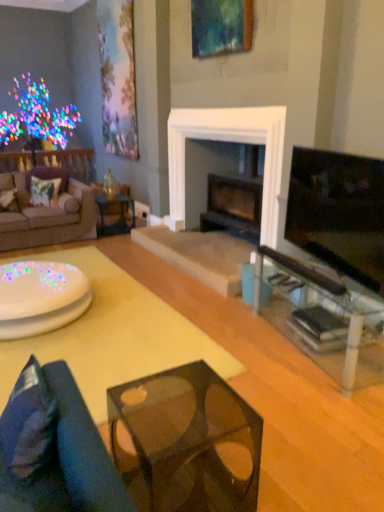
Question: Does brown fabric couch at left, positioned as the 1th studio couch in top-to-bottom order, have a lesser height compared to dark blue fabric pillow at lower left, positioned as the first pillow in front-to-back order?

Choices:
 (A) no
 (B) yes

Answer: (A)

Question: Is brown fabric couch at left, the second studio couch in the front-to-back sequence, turned away from dark blue fabric pillow at lower left, the 3th pillow from the back?

Choices:
 (A) yes
 (B) no

Answer: (B)

Question: Is brown fabric couch at left, which ranks as the 1th studio couch in left-to-right order, further to camera compared to dark blue fabric pillow at lower left, which is counted as the first pillow, starting from the right?

Choices:
 (A) yes
 (B) no

Answer: (A)

Question: Can you confirm if brown fabric couch at left, which is the first studio couch in back-to-front order, is taller than dark blue fabric pillow at lower left, which is counted as the first pillow, starting from the right?

Choices:
 (A) yes
 (B) no

Answer: (A)

Question: Does brown fabric couch at left, which ranks as the 1th studio couch in left-to-right order, lie in front of dark blue fabric pillow at lower left, the 3th pillow from the back?

Choices:
 (A) no
 (B) yes

Answer: (A)

Question: Is transparent glass table at right, marked as the 3th table in a left-to-right arrangement, bigger or smaller than wooden picture frame at upper center, which is the second picture frame from left to right?

Choices:
 (A) big
 (B) small

Answer: (A)

Question: From the image's perspective, relative to wooden picture frame at upper center, the 1th picture frame positioned from the front, is transparent glass table at right, marked as the 3th table in a left-to-right arrangement, above or below?

Choices:
 (A) below
 (B) above

Answer: (A)

Question: Relative to wooden picture frame at upper center, the 1th picture frame positioned from the front, is transparent glass table at right, placed as the 1th table when sorted from right to left, in front or behind?

Choices:
 (A) behind
 (B) front

Answer: (B)

Question: Which is correct: transparent glass table at right, marked as the 3th table in a left-to-right arrangement, is inside wooden picture frame at upper center, the 1th picture frame positioned from the front, or outside of it?

Choices:
 (A) outside
 (B) inside

Answer: (A)

Question: Does point (193, 34) appear closer or farther from the camera than point (1, 296)?

Choices:
 (A) farther
 (B) closer

Answer: (A)

Question: Considering their positions, is wooden picture frame at upper center, which ranks as the second picture frame in back-to-front order, located in front of or behind white glossy table at lower left, acting as the 3th table starting from the right?

Choices:
 (A) behind
 (B) front

Answer: (A)

Question: Looking at their shapes, would you say wooden picture frame at upper center, the 1th picture frame positioned from the front, is wider or thinner than white glossy table at lower left, acting as the 3th table starting from the right?

Choices:
 (A) thin
 (B) wide

Answer: (A)

Question: From their relative heights in the image, would you say wooden picture frame at upper center, which ranks as the second picture frame in back-to-front order, is taller or shorter than white glossy table at lower left, which is counted as the first table, starting from the left?

Choices:
 (A) short
 (B) tall

Answer: (B)

Question: Looking at the image, does translucent glass cube at center, arranged as the 2th table when viewed from the left, seem bigger or smaller compared to matte black tv at right?

Choices:
 (A) small
 (B) big

Answer: (A)

Question: From the image's perspective, is translucent glass cube at center, arranged as the 2th table when viewed from the left, located above or below matte black tv at right?

Choices:
 (A) below
 (B) above

Answer: (A)